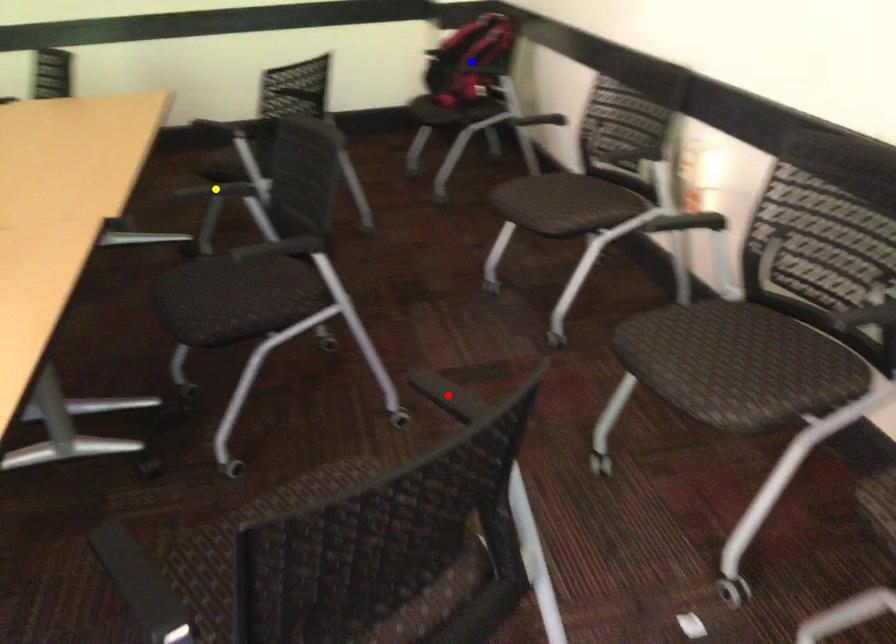
Order these from farthest to nearest:
A) red point
B) blue point
C) yellow point

blue point → yellow point → red point